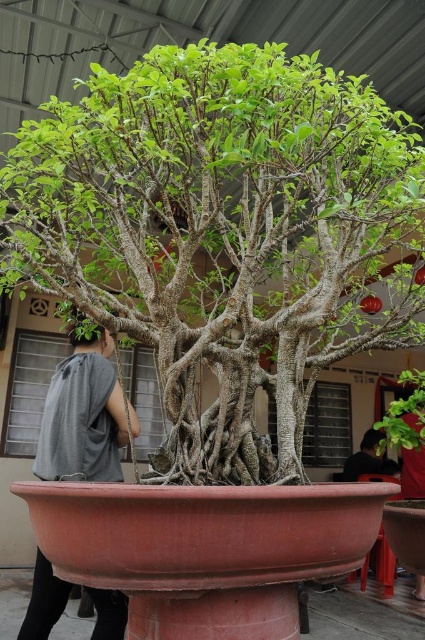
Can you confirm if gray cotton shirt at left is positioned below green matte plant at center?

No.

Can you confirm if gray cotton shirt at left is positioned to the left of green matte plant at center?

Indeed, gray cotton shirt at left is positioned on the left side of green matte plant at center.

Find the location of a particular element. The width and height of the screenshot is (425, 640). gray cotton shirt at left is located at coordinates (85, 416).

Locate an element on the screen. This screenshot has width=425, height=640. gray cotton shirt at left is located at coordinates (85, 416).

From the picture: Between green textured bonsai at center and gray cotton shirt at left, which one has less height?

gray cotton shirt at left is shorter.

Who is taller, green textured bonsai at center or gray cotton shirt at left?

Standing taller between the two is green textured bonsai at center.

Identify the location of green textured bonsai at center. (223, 232).

Which is more to the left, green textured bonsai at center or green matte plant at center?

green textured bonsai at center

Can you confirm if green textured bonsai at center is positioned below green matte plant at center?

No, green textured bonsai at center is not below green matte plant at center.

Image resolution: width=425 pixels, height=640 pixels. In order to click on green textured bonsai at center in this screenshot , I will do `click(223, 232)`.

Find the location of a particular element. Image resolution: width=425 pixels, height=640 pixels. green textured bonsai at center is located at coordinates (223, 232).